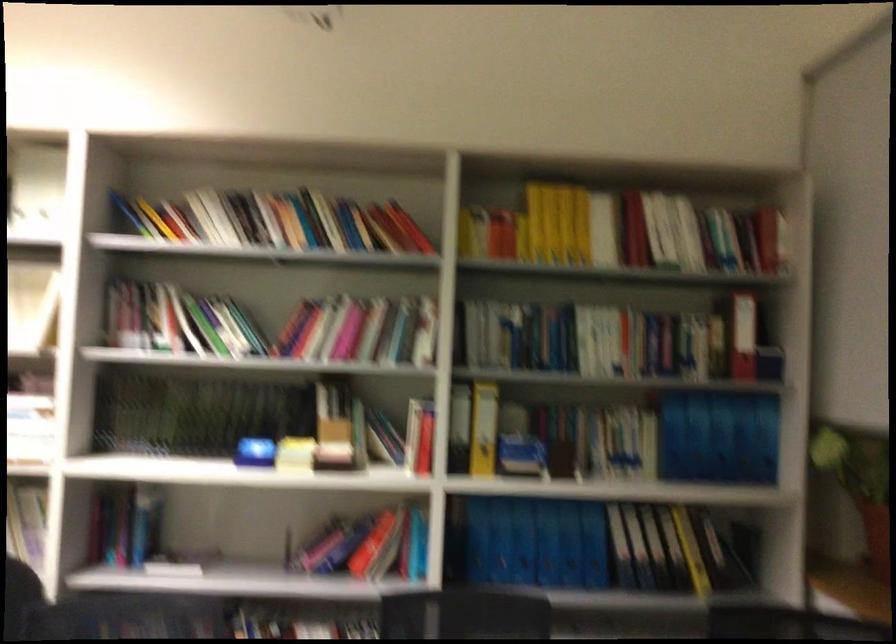
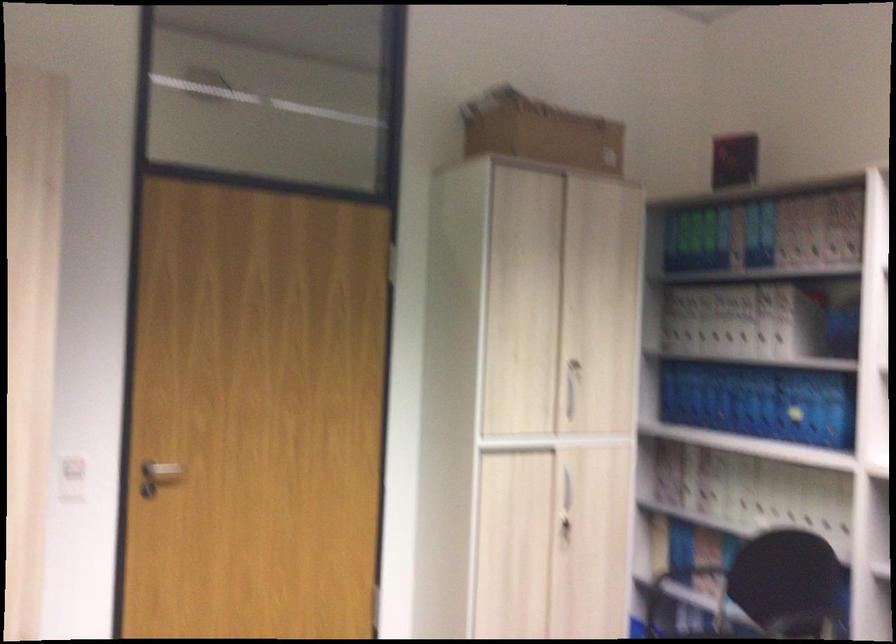
Question: The camera is either moving clockwise (left) or counter-clockwise (right) around the object. The first image is from the beginning of the video and the second image is from the end. Is the camera moving left or right when shooting the video?

Choices:
 (A) Left
 (B) Right

Answer: (B)